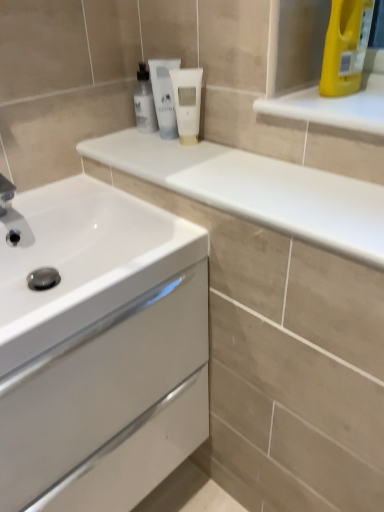
Question: Is white glossy cabinet at lower left surrounded by white matte tube at center, which appears as the second mouthwash when viewed from the right?

Choices:
 (A) yes
 (B) no

Answer: (B)

Question: From a real-world perspective, is white matte tube at center, acting as the 2th mouthwash starting from the left, positioned over white glossy cabinet at lower left based on gravity?

Choices:
 (A) yes
 (B) no

Answer: (A)

Question: Is white matte tube at center, acting as the 2th mouthwash starting from the left, facing towards white glossy cabinet at lower left?

Choices:
 (A) yes
 (B) no

Answer: (B)

Question: Does white matte tube at center, acting as the 2th mouthwash starting from the left, come behind white glossy cabinet at lower left?

Choices:
 (A) no
 (B) yes

Answer: (B)

Question: Is white matte tube at center, acting as the 2th mouthwash starting from the left, taller than white glossy cabinet at lower left?

Choices:
 (A) no
 (B) yes

Answer: (A)

Question: Visually, is white glossy mouthwash at upper center, the 3th mouthwash from the right, positioned to the left or to the right of white glossy cabinet at lower left?

Choices:
 (A) right
 (B) left

Answer: (A)

Question: Considering the positions of white glossy mouthwash at upper center, acting as the 1th mouthwash starting from the left, and white glossy cabinet at lower left in the image, is white glossy mouthwash at upper center, acting as the 1th mouthwash starting from the left, bigger or smaller than white glossy cabinet at lower left?

Choices:
 (A) big
 (B) small

Answer: (B)

Question: Is point (145, 105) positioned closer to the camera than point (82, 249)?

Choices:
 (A) farther
 (B) closer

Answer: (A)

Question: From a real-world perspective, is white glossy mouthwash at upper center, acting as the 1th mouthwash starting from the left, above or below white glossy cabinet at lower left?

Choices:
 (A) below
 (B) above

Answer: (B)

Question: Visually, is white glossy cabinet at lower left positioned to the left or to the right of white matte tube at center, the first mouthwash from the right?

Choices:
 (A) left
 (B) right

Answer: (A)

Question: From the image's perspective, is white glossy cabinet at lower left located above or below white matte tube at center, marked as the third mouthwash in a left-to-right arrangement?

Choices:
 (A) above
 (B) below

Answer: (B)

Question: Looking at their shapes, would you say white glossy cabinet at lower left is wider or thinner than white matte tube at center, the first mouthwash from the right?

Choices:
 (A) wide
 (B) thin

Answer: (A)

Question: Looking at the image, does white glossy cabinet at lower left seem bigger or smaller compared to white matte tube at center, the first mouthwash from the right?

Choices:
 (A) small
 (B) big

Answer: (B)

Question: Is point [137, 105] positioned closer to the camera than point [157, 64]?

Choices:
 (A) closer
 (B) farther

Answer: (B)

Question: Based on their positions, is white glossy mouthwash at upper center, acting as the 1th mouthwash starting from the left, located to the left or right of white matte tube at center, acting as the 2th mouthwash starting from the left?

Choices:
 (A) left
 (B) right

Answer: (A)